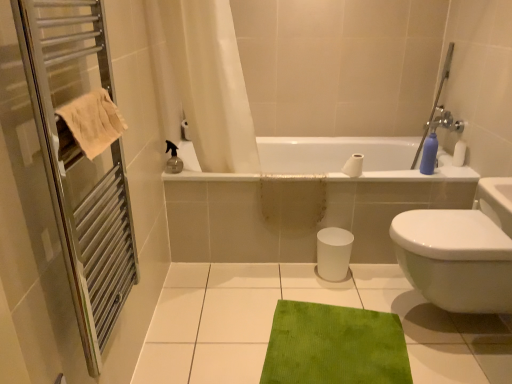
The height and width of the screenshot is (384, 512). I want to click on vacant region in front of white glossy bidet at lower right, so click(454, 362).